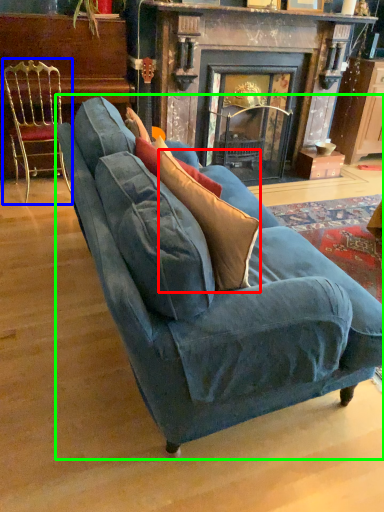
Question: Which is nearer to the throw pillow (highlighted by a red box)? chair (highlighted by a blue box) or studio couch (highlighted by a green box).

Choices:
 (A) chair
 (B) studio couch

Answer: (B)